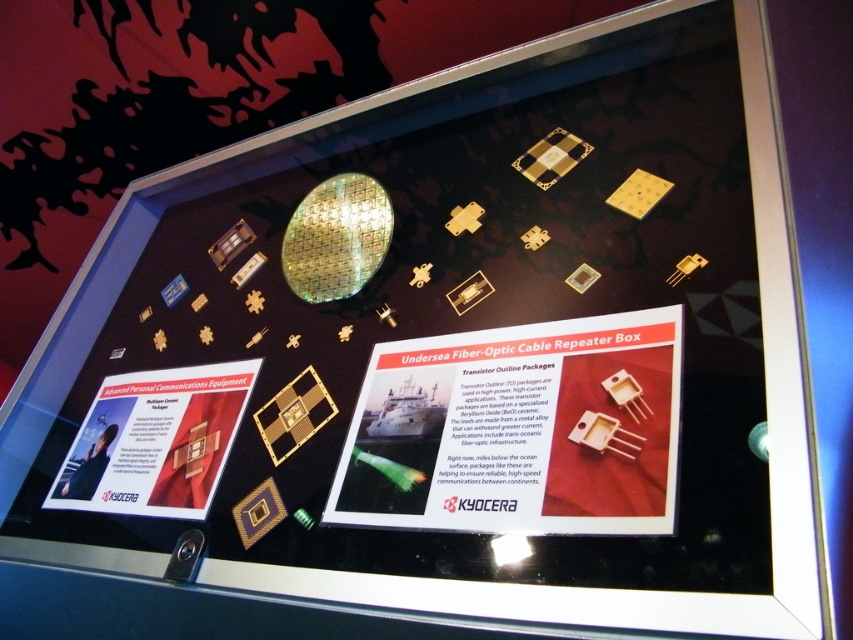
Does white paper at center lie behind white glossy poster at lower left?

That is False.

Which is in front, point (370, 460) or point (106, 467)?

Point (370, 460) is in front.

At what (x,y) coordinates should I click in order to perform the action: click on white paper at center. Please return your answer as a coordinate pair (x, y). This screenshot has width=853, height=640. Looking at the image, I should click on (518, 429).

Is point (468, 360) farther from camera compared to point (302, 413)?

No, it is not.

Which of these two, white paper at center or gold metallic square at center, stands shorter?

gold metallic square at center

This screenshot has width=853, height=640. What do you see at coordinates (518, 429) in the screenshot? I see `white paper at center` at bounding box center [518, 429].

Locate an element on the screen. white paper at center is located at coordinates (518, 429).

Is point (218, 442) in front of point (316, 403)?

No, (218, 442) is further to viewer.

Is white glossy poster at lower left below gold metallic square at center?

Yes, white glossy poster at lower left is below gold metallic square at center.

Image resolution: width=853 pixels, height=640 pixels. Describe the element at coordinates (155, 442) in the screenshot. I see `white glossy poster at lower left` at that location.

I want to click on white glossy poster at lower left, so click(x=155, y=442).